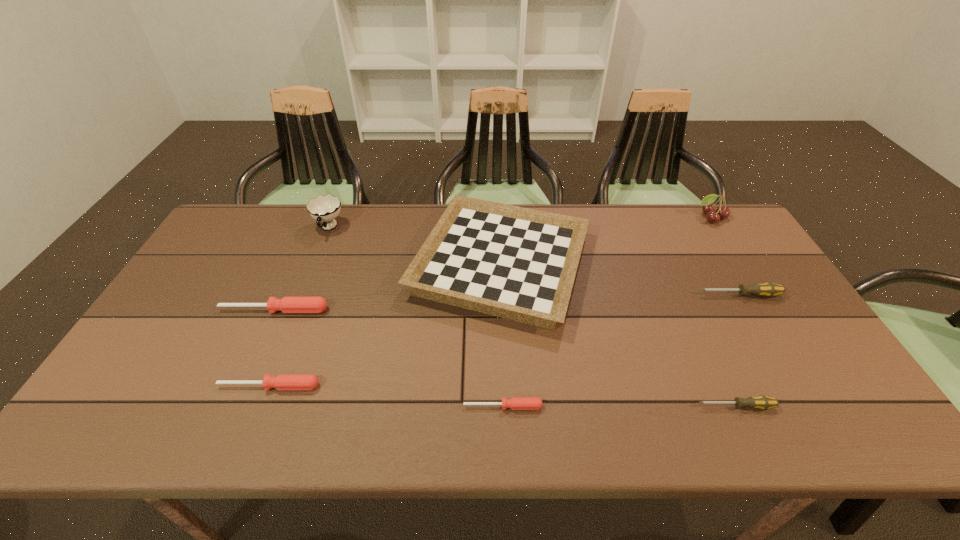
Find the location of a particular element. Image resolution: width=960 pixels, height=540 pixels. the shortest screwdriver is located at coordinates (515, 403).

Locate an element on the screen. the shortest object is located at coordinates (515, 403).

I want to click on vacant space located on the leaves of the red cherry, so click(x=761, y=299).

Locate an element on the screen. vacant space located on the side of the cup with the handle is located at coordinates (303, 292).

Locate an element on the screen. Image resolution: width=960 pixels, height=540 pixels. vacant position located on the front of the checkerboard is located at coordinates (508, 408).

Find the location of a particular element. free spot located 0.070m at the tip of the farther gray screwdriver is located at coordinates (673, 295).

Locate an element on the screen. This screenshot has height=540, width=960. vacant space located at the tip of the farther gray screwdriver is located at coordinates (638, 295).

You are a GUI agent. You are given a task and a screenshot of the screen. Output one action in this format:
    pyautogui.click(x=<x>, y=<y>)
    Task: Click on the vacant space situated 0.380m at the tip of the farther gray screwdriver
    This screenshot has height=540, width=960.
    Given the screenshot: What is the action you would take?
    pyautogui.click(x=565, y=295)

Where is `free space located on the back of the fourth nearest screwdriver`? Image resolution: width=960 pixels, height=540 pixels. free space located on the back of the fourth nearest screwdriver is located at coordinates (287, 282).

Image resolution: width=960 pixels, height=540 pixels. Identify the location of vacant space situated 0.050m on the right of the third farthest screwdriver. (341, 386).